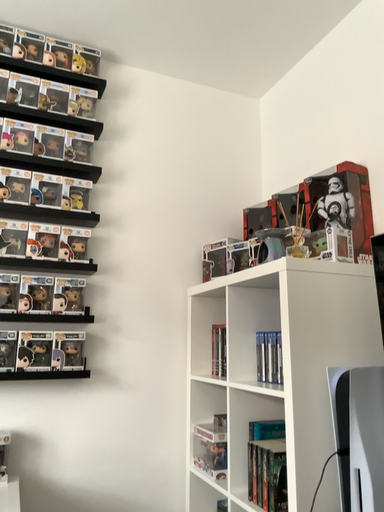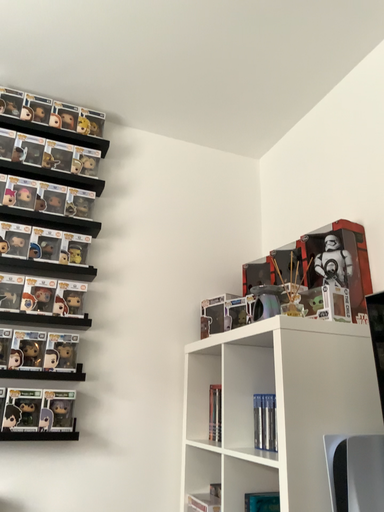
Question: How did the camera likely rotate when shooting the video?

Choices:
 (A) rotated downward
 (B) rotated upward

Answer: (B)